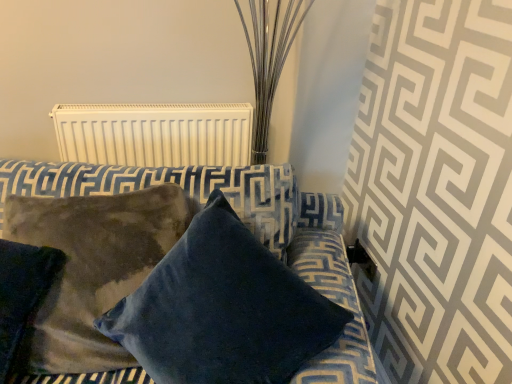
Question: Can you confirm if velvet blue pillow at center, arranged as the first pillow when viewed from the right, is positioned to the right of suede-like brown pillow at lower left, placed as the first pillow when sorted from left to right?

Choices:
 (A) yes
 (B) no

Answer: (A)

Question: Can you confirm if velvet blue pillow at center, arranged as the first pillow when viewed from the right, is positioned to the left of suede-like brown pillow at lower left, which is counted as the second pillow, starting from the right?

Choices:
 (A) no
 (B) yes

Answer: (A)

Question: From a real-world perspective, is velvet blue pillow at center, which ranks as the 2th pillow in left-to-right order, under suede-like brown pillow at lower left, placed as the first pillow when sorted from left to right?

Choices:
 (A) no
 (B) yes

Answer: (A)

Question: Is velvet blue pillow at center, which ranks as the 2th pillow in left-to-right order, bigger than suede-like brown pillow at lower left, which is counted as the second pillow, starting from the right?

Choices:
 (A) yes
 (B) no

Answer: (A)

Question: Can you confirm if velvet blue pillow at center, which ranks as the 2th pillow in left-to-right order, is wider than suede-like brown pillow at lower left, which is counted as the second pillow, starting from the right?

Choices:
 (A) yes
 (B) no

Answer: (A)

Question: From the image's perspective, is velvet blue pillow at center, arranged as the first pillow when viewed from the right, above suede-like brown pillow at lower left, placed as the first pillow when sorted from left to right?

Choices:
 (A) yes
 (B) no

Answer: (B)

Question: Considering the relative sizes of suede-like brown pillow at lower left, placed as the first pillow when sorted from left to right, and white matte radiator at upper center in the image provided, is suede-like brown pillow at lower left, placed as the first pillow when sorted from left to right, bigger than white matte radiator at upper center?

Choices:
 (A) yes
 (B) no

Answer: (A)

Question: Considering the relative positions of suede-like brown pillow at lower left, which is counted as the second pillow, starting from the right, and white matte radiator at upper center in the image provided, is suede-like brown pillow at lower left, which is counted as the second pillow, starting from the right, to the left of white matte radiator at upper center from the viewer's perspective?

Choices:
 (A) yes
 (B) no

Answer: (A)

Question: From a real-world perspective, is suede-like brown pillow at lower left, placed as the first pillow when sorted from left to right, under white matte radiator at upper center?

Choices:
 (A) no
 (B) yes

Answer: (B)

Question: Can you confirm if suede-like brown pillow at lower left, placed as the first pillow when sorted from left to right, is thinner than white matte radiator at upper center?

Choices:
 (A) no
 (B) yes

Answer: (A)

Question: Is suede-like brown pillow at lower left, placed as the first pillow when sorted from left to right, not inside white matte radiator at upper center?

Choices:
 (A) no
 (B) yes

Answer: (B)

Question: Is suede-like brown pillow at lower left, which is counted as the second pillow, starting from the right, looking in the opposite direction of white matte radiator at upper center?

Choices:
 (A) no
 (B) yes

Answer: (B)

Question: Does white matte radiator at upper center have a lesser height compared to velvet blue pillow at center, which ranks as the 2th pillow in left-to-right order?

Choices:
 (A) yes
 (B) no

Answer: (A)